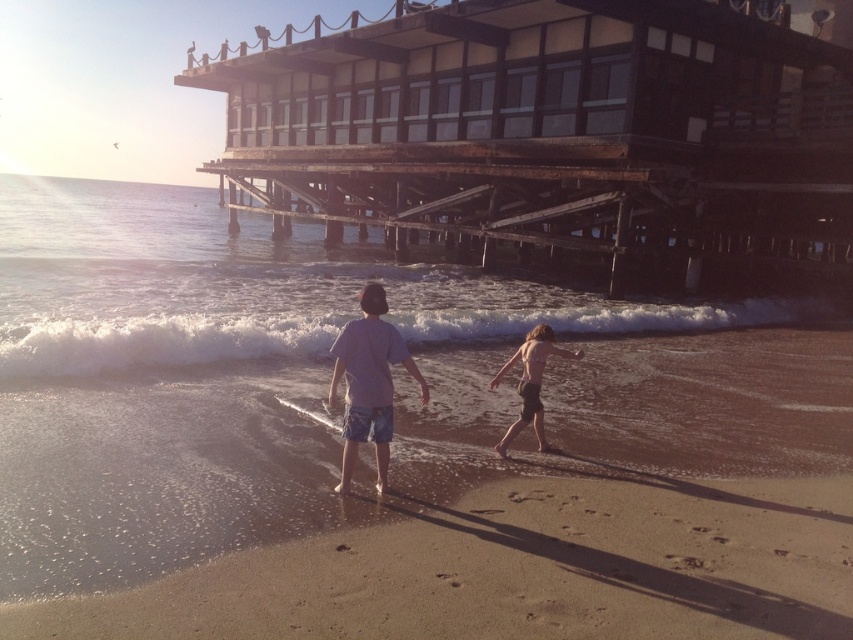
You are standing at the point with coordinates point (498,20) and want to walk towards the point with coordinates point (524,397). Based on the scene description, will you be walking towards the ocean or away from it?

Based on the scene description, the two individuals are walking along the wet sand near the shoreline. Since point (498,20) is behind point (524,397), this implies that walking from point (498,20) towards point (524,397) would mean moving in the direction the individuals are facing, which is along the shoreline. Therefore, you would be walking parallel to the ocean, neither directly towards nor away from it.